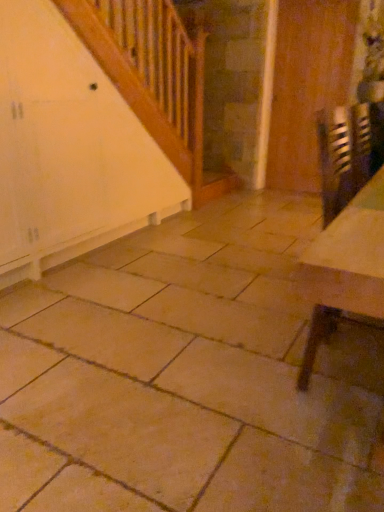
Question: From the image's perspective, is metallic reflective table at lower right above or below wooden door at right?

Choices:
 (A) below
 (B) above

Answer: (A)

Question: Is metallic reflective table at lower right situated inside wooden door at right or outside?

Choices:
 (A) inside
 (B) outside

Answer: (B)

Question: Based on their sizes in the image, would you say metallic reflective table at lower right is bigger or smaller than wooden door at right?

Choices:
 (A) small
 (B) big

Answer: (B)

Question: Do you think wooden door at right is within metallic reflective table at lower right, or outside of it?

Choices:
 (A) inside
 (B) outside

Answer: (B)

Question: Would you say wooden door at right is to the left or to the right of metallic reflective table at lower right in the picture?

Choices:
 (A) right
 (B) left

Answer: (A)

Question: Considering their positions, is wooden door at right located in front of or behind metallic reflective table at lower right?

Choices:
 (A) front
 (B) behind

Answer: (B)

Question: In terms of height, does wooden door at right look taller or shorter compared to metallic reflective table at lower right?

Choices:
 (A) short
 (B) tall

Answer: (B)